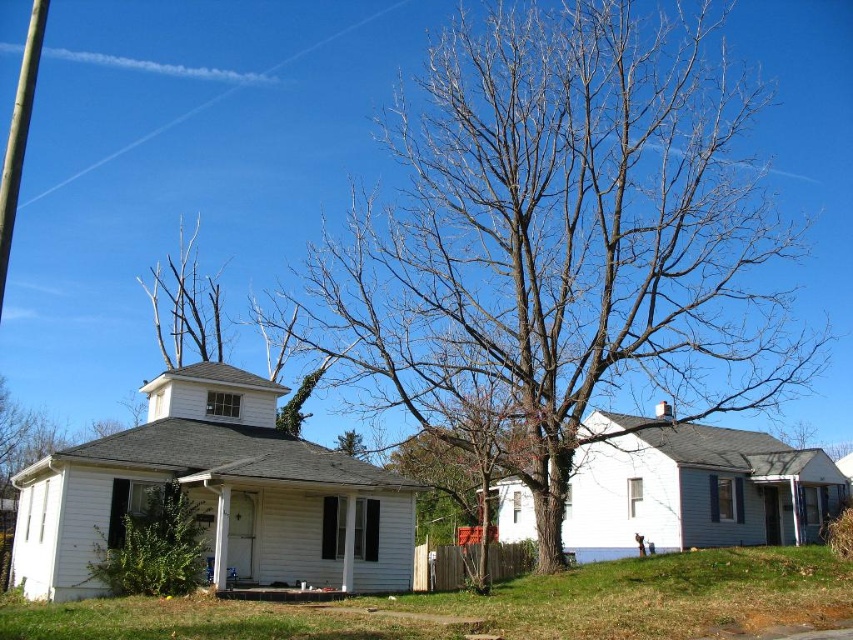
Question: Which object appears farthest from the camera in this image?

Choices:
 (A) white matte house at center
 (B) brown/dry bark tree at center
 (C) green leafy tree at center

Answer: (C)

Question: Is brown/dry bark tree at center further to the viewer compared to white wood house at center?

Choices:
 (A) no
 (B) yes

Answer: (B)

Question: Which object is closer to the camera taking this photo?

Choices:
 (A) brown/dry bark tree at center
 (B) bare branches at upper center

Answer: (A)

Question: Does brown/dry bark tree at center come in front of white wood house at center?

Choices:
 (A) yes
 (B) no

Answer: (B)

Question: Can you confirm if bare branches at upper center is positioned to the right of green leafy tree at center?

Choices:
 (A) no
 (B) yes

Answer: (A)

Question: Which object is the farthest from the white wood house at center?

Choices:
 (A) green leafy tree at center
 (B) white matte house at center
 (C) bare branches at upper center

Answer: (A)